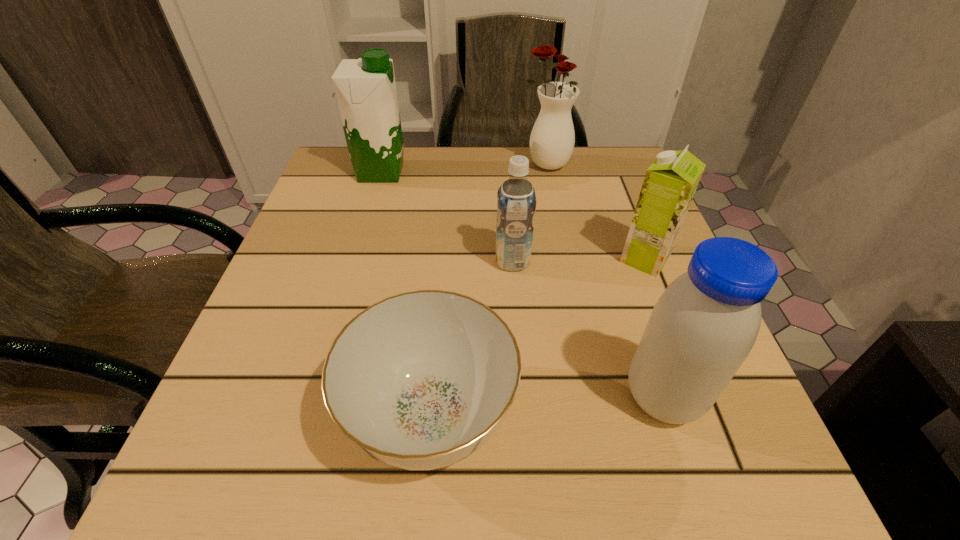
In order to click on vacant space located 0.190m on the label of the second soya milk from left to right in this screenshot , I will do `click(395, 261)`.

This screenshot has width=960, height=540. I want to click on free space located on the left of the shortest object, so click(303, 415).

At what (x,y) coordinates should I click in order to perform the action: click on vase located in the far edge section of the desktop. Please return your answer as a coordinate pair (x, y). The image size is (960, 540). Looking at the image, I should click on (552, 139).

The height and width of the screenshot is (540, 960). I want to click on soya milk that is at the far edge, so click(365, 88).

I want to click on object at the near edge, so click(421, 380).

Locate an element on the screen. object that is at the left edge is located at coordinates (365, 88).

You are a GUI agent. You are given a task and a screenshot of the screen. Output one action in this format:
    pyautogui.click(x=<x>, y=<y>)
    Task: Click on the vase at the right edge
    The height and width of the screenshot is (540, 960).
    Given the screenshot: What is the action you would take?
    pyautogui.click(x=552, y=139)

Where is `object at the far left corner`? object at the far left corner is located at coordinates (365, 88).

Where is `object that is positioned at the far right corner`? This screenshot has height=540, width=960. object that is positioned at the far right corner is located at coordinates (552, 139).

This screenshot has height=540, width=960. What are the coordinates of `vacant region at the far edge of the desktop` in the screenshot? It's located at (451, 187).